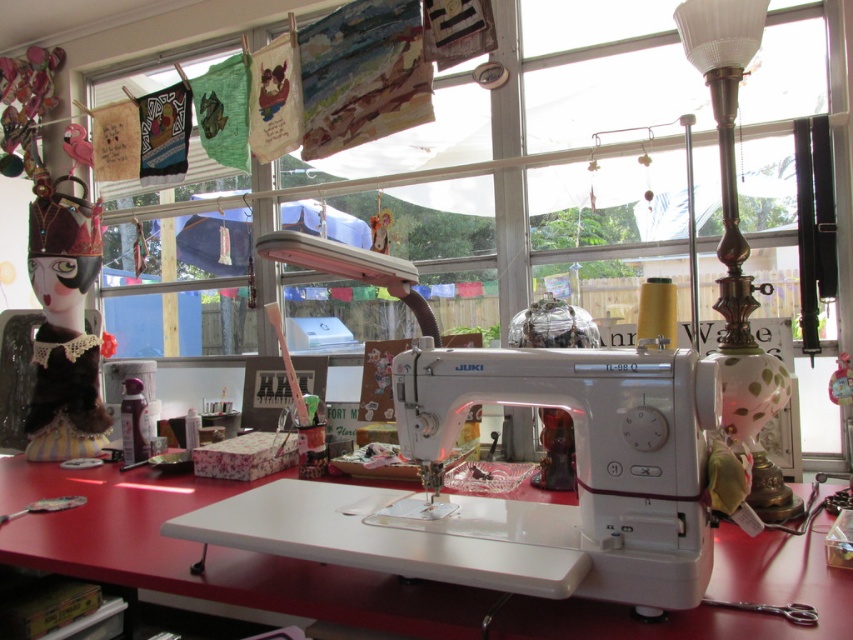
Question: Is white plastic table at center smaller than polished brass lamp at right?

Choices:
 (A) yes
 (B) no

Answer: (B)

Question: Which object appears closest to the camera in this image?

Choices:
 (A) polished brass lamp at right
 (B) white plastic sewing machine at center

Answer: (B)

Question: Does white plastic table at center have a greater width compared to polished brass lamp at right?

Choices:
 (A) yes
 (B) no

Answer: (A)

Question: Which of the following is the farthest from the observer?

Choices:
 (A) (763, 244)
 (B) (79, 269)
 (C) (271, 557)
 (D) (729, 355)

Answer: (B)

Question: Which object is positioned farthest from the white plastic sewing machine at center?

Choices:
 (A) transparent plastic window at center
 (B) velvet brown doll at left

Answer: (B)

Question: Does white plastic sewing machine at center have a smaller size compared to velvet brown doll at left?

Choices:
 (A) yes
 (B) no

Answer: (A)